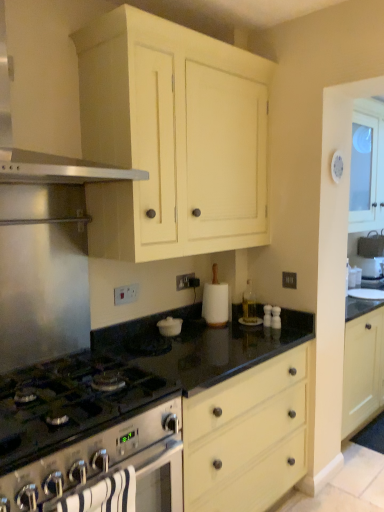
Question: Would you consider black granite countertop at center to be distant from clear glass bottle at center?

Choices:
 (A) no
 (B) yes

Answer: (A)

Question: Considering the relative positions of black granite countertop at center and clear glass bottle at center in the image provided, is black granite countertop at center behind clear glass bottle at center?

Choices:
 (A) yes
 (B) no

Answer: (B)

Question: Is black granite countertop at center in front of clear glass bottle at center?

Choices:
 (A) no
 (B) yes

Answer: (B)

Question: From the image's perspective, does black granite countertop at center appear higher than clear glass bottle at center?

Choices:
 (A) yes
 (B) no

Answer: (B)

Question: From a real-world perspective, is black granite countertop at center positioned under clear glass bottle at center based on gravity?

Choices:
 (A) no
 (B) yes

Answer: (B)

Question: From a real-world perspective, is black granite countertop at center on clear glass bottle at center?

Choices:
 (A) no
 (B) yes

Answer: (A)

Question: Does satin silver gas stove at lower left have a larger size compared to matte cream cabinet at upper center?

Choices:
 (A) yes
 (B) no

Answer: (B)

Question: Is satin silver gas stove at lower left positioned beyond the bounds of matte cream cabinet at upper center?

Choices:
 (A) no
 (B) yes

Answer: (B)

Question: From a real-world perspective, does satin silver gas stove at lower left stand above matte cream cabinet at upper center?

Choices:
 (A) yes
 (B) no

Answer: (B)

Question: Is the position of satin silver gas stove at lower left less distant than that of matte cream cabinet at upper center?

Choices:
 (A) yes
 (B) no

Answer: (A)

Question: Could you tell me if satin silver gas stove at lower left is turned towards matte cream cabinet at upper center?

Choices:
 (A) yes
 (B) no

Answer: (B)

Question: Is satin silver gas stove at lower left not near matte cream cabinet at upper center?

Choices:
 (A) no
 (B) yes

Answer: (A)

Question: Does satin silver range hood at upper left have a larger size compared to black granite countertop at center?

Choices:
 (A) yes
 (B) no

Answer: (B)